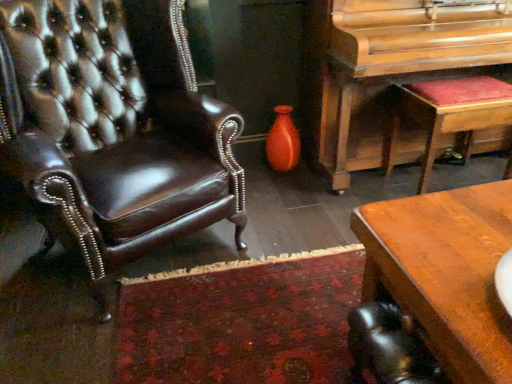
Find the location of `free spot above brown wooden desk at lower right (from a real-world perspective)`. free spot above brown wooden desk at lower right (from a real-world perspective) is located at coordinates coord(399,340).